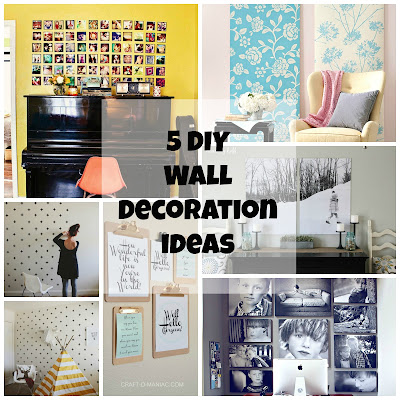
Locate an element on the screen. The height and width of the screenshot is (400, 400). label: wall is located at coordinates (168, 172).